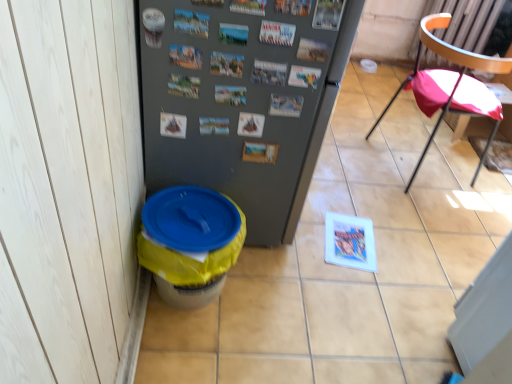
Image resolution: width=512 pixels, height=384 pixels. In order to click on vacant space to the right of pink fabric chair at right in this screenshot , I will do `click(482, 181)`.